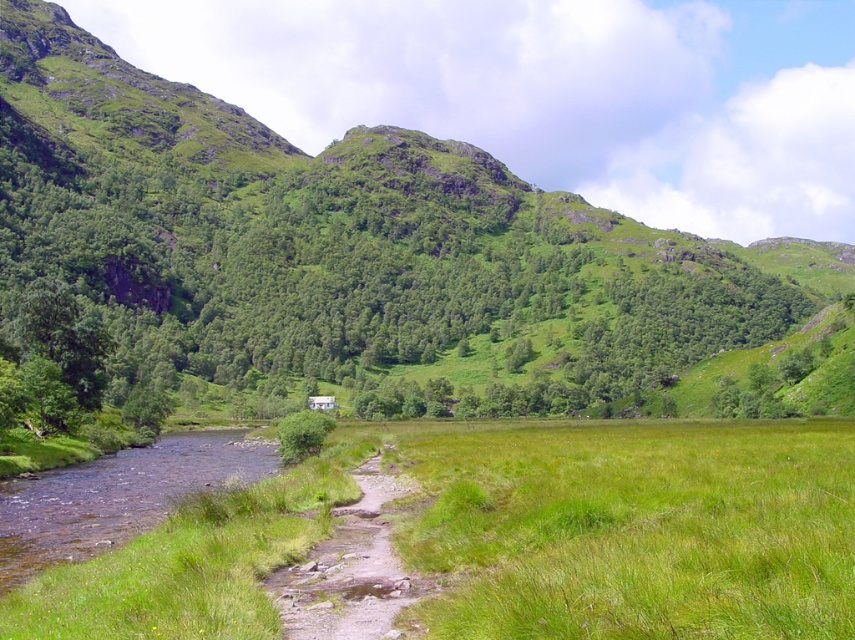
Which is below, green grassy hillside at center or dirt path at lower center?

dirt path at lower center is below.

Is point (346, 358) farther from camera compared to point (343, 608)?

Yes.

Identify the location of green grassy hillside at center. This screenshot has height=640, width=855. (348, 246).

You are a GUI agent. You are given a task and a screenshot of the screen. Output one action in this format:
    pyautogui.click(x=<x>, y=<y>)
    Task: Click on the green grassy hillside at center
    
    Given the screenshot: What is the action you would take?
    tap(348, 246)

Who is more forward, (380,307) or (95,541)?

Point (95,541) is more forward.

Consider the image. Can you confirm if green grassy hillside at center is positioned to the left of clear water at bottom left?

In fact, green grassy hillside at center is to the right of clear water at bottom left.

Is point (688, 244) positioned in front of point (125, 488)?

No, it is not.

Where is `green grassy hillside at center`? The height and width of the screenshot is (640, 855). green grassy hillside at center is located at coordinates (348, 246).

Between clear water at bottom left and dirt path at lower center, which one appears on the left side from the viewer's perspective?

Positioned to the left is clear water at bottom left.

Is clear water at bottom left positioned at the back of dirt path at lower center?

Yes, clear water at bottom left is further from the viewer.

Is point (217, 444) positioned in front of point (386, 541)?

No, (217, 444) is behind (386, 541).

Locate an element on the screen. The height and width of the screenshot is (640, 855). clear water at bottom left is located at coordinates (115, 497).